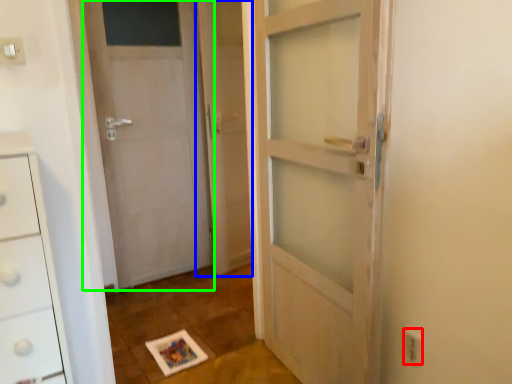
Question: Which object is positioned farthest from electric outlet (highlighted by a red box)? Select from screen door (highlighted by a blue box) and door (highlighted by a green box).

Choices:
 (A) screen door
 (B) door

Answer: (B)